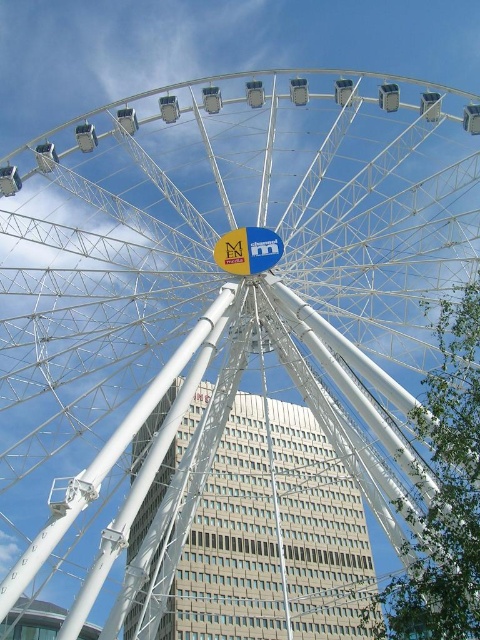
Which of these two, beige glass building at center or yellow fabric sign at center, stands shorter?

yellow fabric sign at center is shorter.

Does beige glass building at center lie in front of yellow fabric sign at center?

That is True.

Is point (195, 401) farther from camera compared to point (274, 237)?

Yes, it is.

Locate an element on the screen. beige glass building at center is located at coordinates (273, 536).

Does beige glass building at center appear on the right side of white metallic pole at center?

Indeed, beige glass building at center is positioned on the right side of white metallic pole at center.

Between beige glass building at center and white metallic pole at center, which one has less height?

white metallic pole at center

Locate an element on the screen. The height and width of the screenshot is (640, 480). beige glass building at center is located at coordinates (273, 536).

The width and height of the screenshot is (480, 640). What are the coordinates of `white metallic pole at center` in the screenshot? It's located at (146, 470).

Which of these two, white metallic pole at center or yellow fabric sign at center, stands shorter?

yellow fabric sign at center

The width and height of the screenshot is (480, 640). I want to click on white metallic pole at center, so click(x=146, y=470).